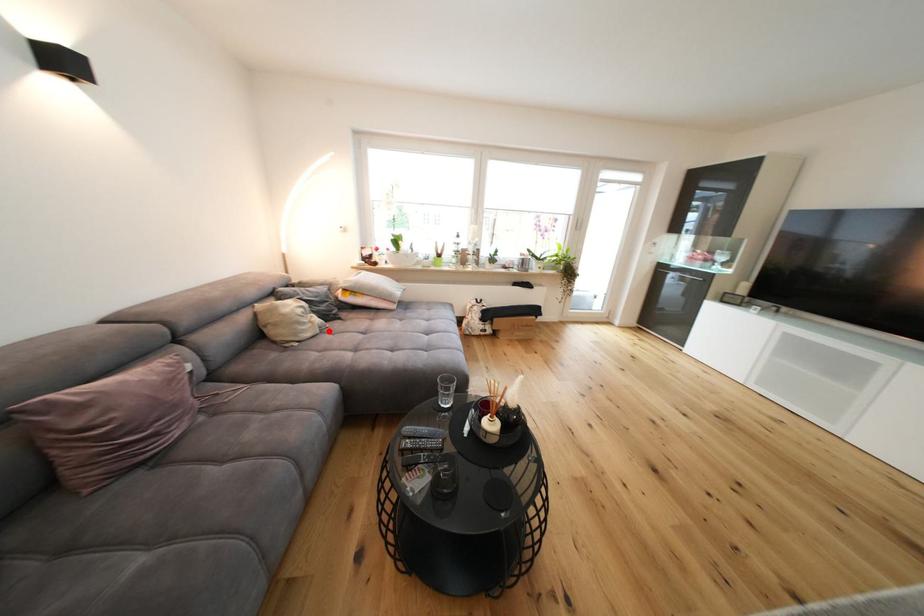
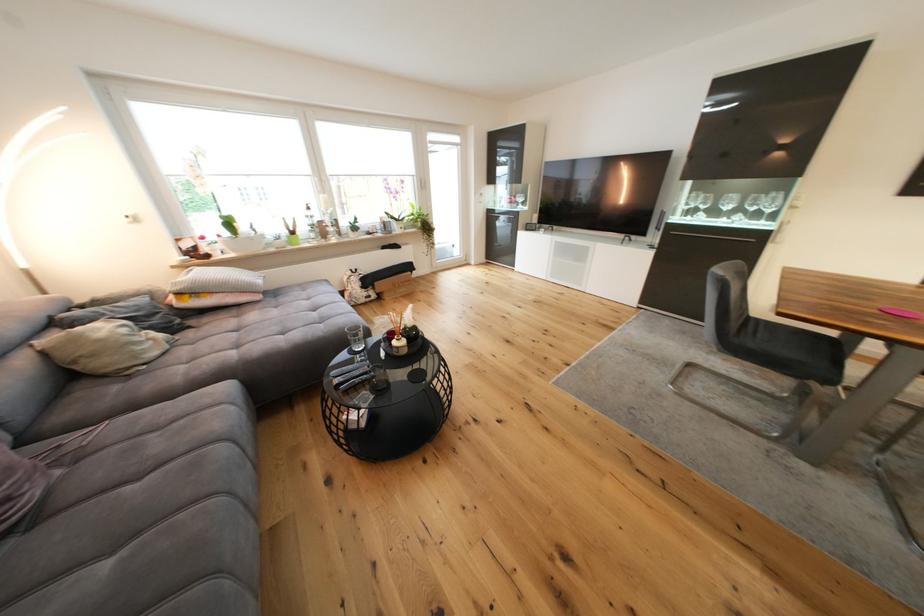
The point at the highlighted location is marked in the first image. Where is the corresponding point in the second image?

(178, 345)